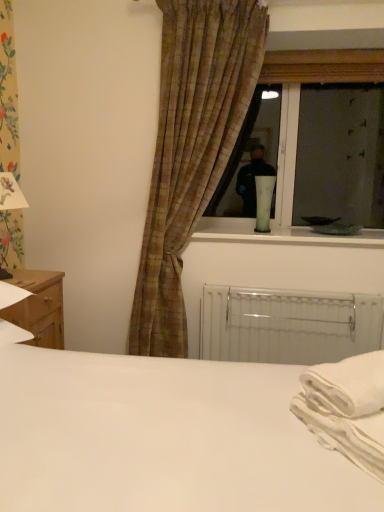
Question: Is plaid fabric curtain at center thinner than green glass vase at window, the 1th table lamp from the right?

Choices:
 (A) no
 (B) yes

Answer: (A)

Question: Does plaid fabric curtain at center appear on the right side of green glass vase at window, which is the 2th table lamp in front-to-back order?

Choices:
 (A) no
 (B) yes

Answer: (A)

Question: From the image's perspective, does plaid fabric curtain at center appear lower than green glass vase at window, marked as the 1th table lamp in a back-to-front arrangement?

Choices:
 (A) yes
 (B) no

Answer: (B)

Question: Is plaid fabric curtain at center at the left side of green glass vase at window, which is counted as the second table lamp, starting from the left?

Choices:
 (A) no
 (B) yes

Answer: (B)

Question: Does plaid fabric curtain at center have a smaller size compared to green glass vase at window, which is counted as the second table lamp, starting from the left?

Choices:
 (A) no
 (B) yes

Answer: (A)

Question: Is white metallic radiator at lower center wider or thinner than white cotton cloth at lower right?

Choices:
 (A) wide
 (B) thin

Answer: (B)

Question: Is point (210, 296) positioned closer to the camera than point (312, 366)?

Choices:
 (A) closer
 (B) farther

Answer: (B)

Question: From the image's perspective, is white metallic radiator at lower center above or below white cotton cloth at lower right?

Choices:
 (A) above
 (B) below

Answer: (B)

Question: From a real-world perspective, is white metallic radiator at lower center physically located above or below white cotton cloth at lower right?

Choices:
 (A) above
 (B) below

Answer: (B)

Question: Considering the positions of white metallic radiator at lower center and white matte bed at center in the image, is white metallic radiator at lower center wider or thinner than white matte bed at center?

Choices:
 (A) wide
 (B) thin

Answer: (B)

Question: Considering the positions of point (304, 317) and point (162, 386), is point (304, 317) closer or farther from the camera than point (162, 386)?

Choices:
 (A) farther
 (B) closer

Answer: (A)

Question: Based on their positions, is white metallic radiator at lower center located to the left or right of white matte bed at center?

Choices:
 (A) left
 (B) right

Answer: (B)

Question: From a real-world perspective, is white metallic radiator at lower center above or below white matte bed at center?

Choices:
 (A) above
 (B) below

Answer: (B)

Question: In terms of height, does plaid fabric curtain at center look taller or shorter compared to green glass vase at window, the 1th table lamp from the right?

Choices:
 (A) tall
 (B) short

Answer: (A)

Question: From a real-world perspective, relative to green glass vase at window, marked as the 1th table lamp in a back-to-front arrangement, is plaid fabric curtain at center vertically above or below?

Choices:
 (A) below
 (B) above

Answer: (B)